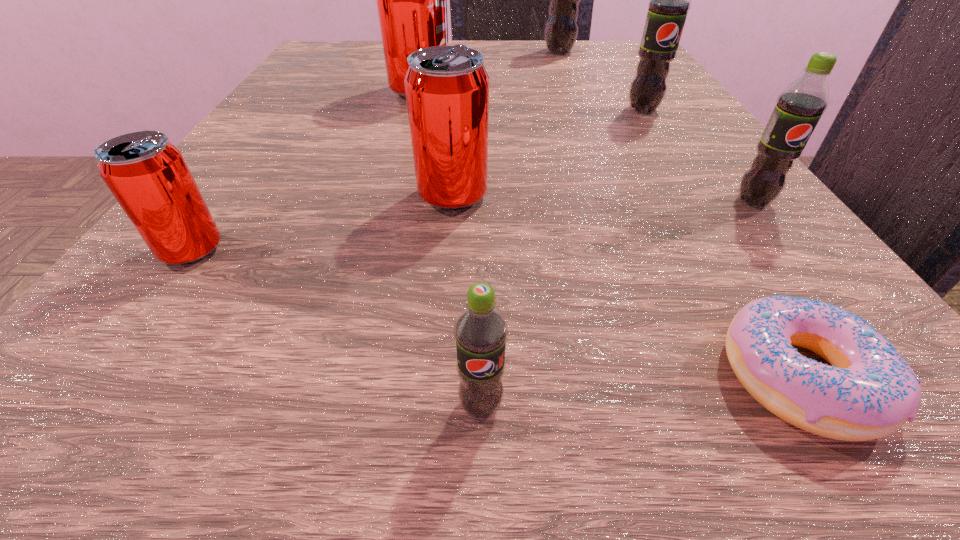
The width and height of the screenshot is (960, 540). Find the location of `the tallest object`. the tallest object is located at coordinates (561, 30).

I want to click on the biggest green soda, so click(x=561, y=30).

Locate an element on the screen. The height and width of the screenshot is (540, 960). the biggest red soda can is located at coordinates (411, 0).

What are the coordinates of `the second farthest green soda` in the screenshot? It's located at (669, 0).

Where is `the third green soda from left to right`? This screenshot has width=960, height=540. the third green soda from left to right is located at coordinates (669, 0).

Image resolution: width=960 pixels, height=540 pixels. I want to click on the rightmost soda, so click(799, 107).

Where is `the third farthest green soda`? Image resolution: width=960 pixels, height=540 pixels. the third farthest green soda is located at coordinates (799, 107).

I want to click on the second biggest red soda can, so click(447, 87).

Identify the location of the leftmost red soda can. (147, 174).

Find the location of a particular element. The height and width of the screenshot is (540, 960). the leftmost object is located at coordinates (147, 174).